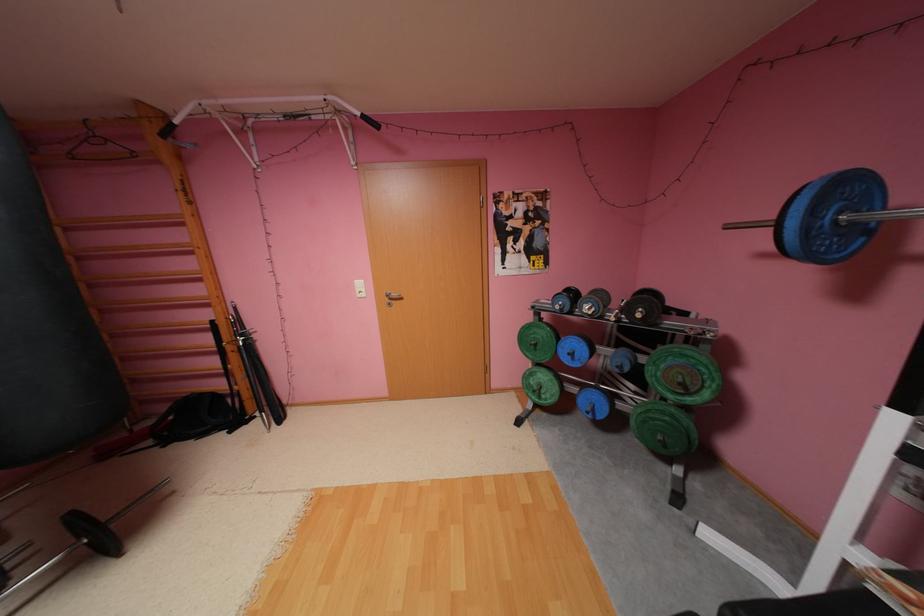
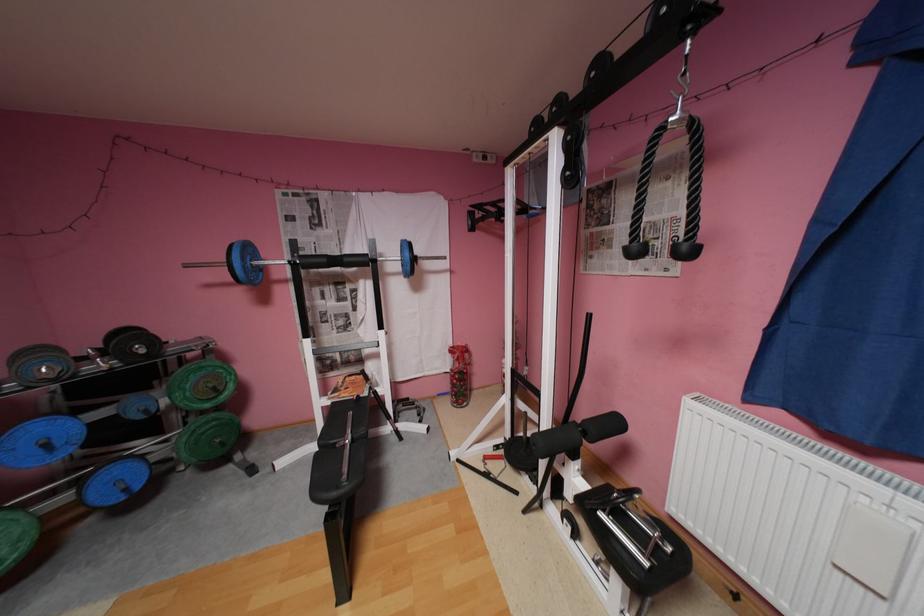
Question: How did the camera likely rotate?

Choices:
 (A) Left
 (B) Right
 (C) Up
 (D) Down

Answer: (B)